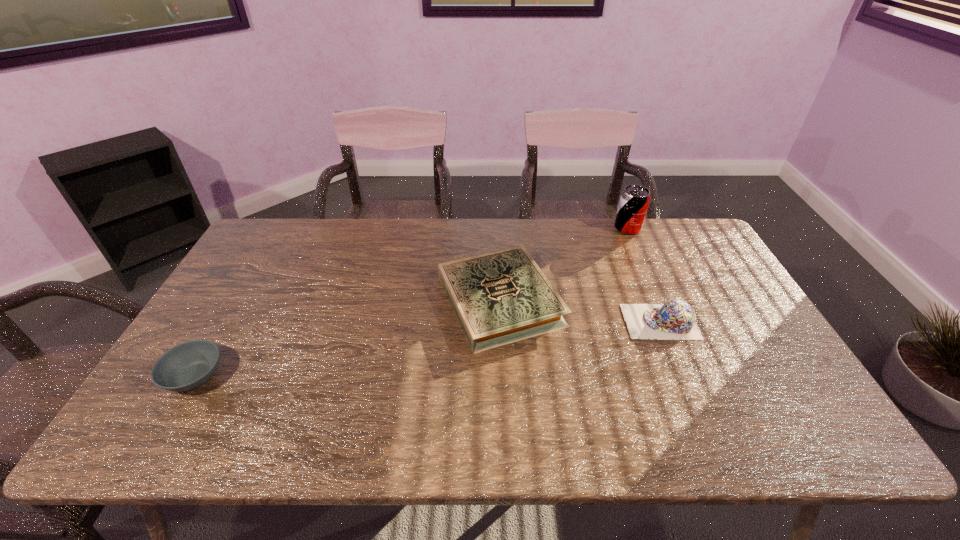
Locate which object ranks second in proximity to the leftmost object. Please provide its 2D coordinates. Your answer should be formatted as a tuple, i.e. [(x, y)], where the tuple contains the x and y coordinates of a point satisfying the conditions above.

[(675, 319)]

Where is `free spot that satisfies the following two spatial constraints: 1. on the back side of the farthest object; 2. on the left side of the leftmost object`? free spot that satisfies the following two spatial constraints: 1. on the back side of the farthest object; 2. on the left side of the leftmost object is located at coordinates (282, 228).

The height and width of the screenshot is (540, 960). Find the location of `free space that satisfies the following two spatial constraints: 1. on the back side of the tallest object; 2. on the right side of the hardback book`. free space that satisfies the following two spatial constraints: 1. on the back side of the tallest object; 2. on the right side of the hardback book is located at coordinates (496, 228).